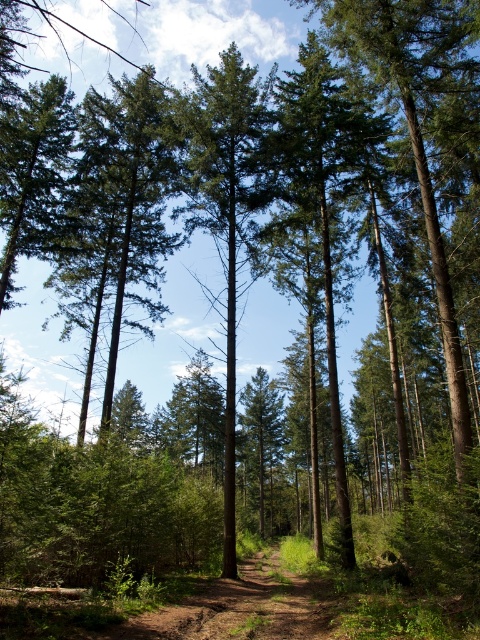
You are a hiker standing on the narrow dirt path at center. You notice two trees ahead of you, a green rough bark tree at center and a green matte tree at center. Which tree is taller?

The green rough bark tree at center is taller than the green matte tree at center.

You are a hiker standing on the narrow dirt path at center. You notice two trees ahead of you, the green rough bark tree at center and the green matte tree at center. Which tree appears closer to you?

The green matte tree at center appears closer because the green rough bark tree at center is located above it, indicating it is further back in the scene.